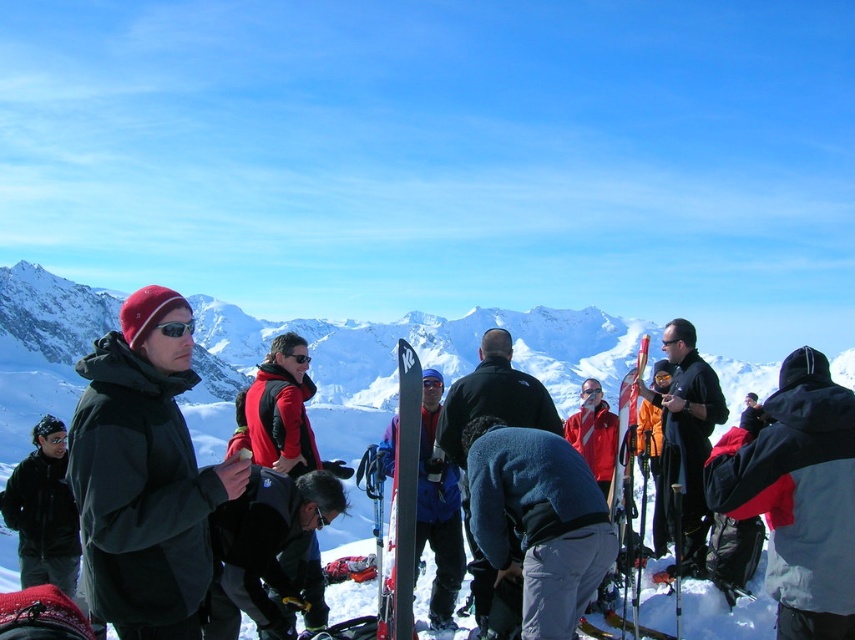
Is point (817, 627) farther from camera compared to point (380, 557)?

No, (817, 627) is closer to viewer.

Which is below, red jacket at center or matte black ski at center?

Positioned lower is matte black ski at center.

Measure the distance between point [841,403] and camera.

Point [841,403] and camera are 65.59 meters apart.

This screenshot has width=855, height=640. Identify the location of red jacket at center. (795, 493).

Can you confirm if white powder snow at center is smaller than black matte goggles at center?

No, white powder snow at center is not smaller than black matte goggles at center.

Based on the photo, can you confirm if white powder snow at center is positioned above black matte goggles at center?

No, white powder snow at center is not above black matte goggles at center.

The image size is (855, 640). Identify the location of white powder snow at center. (394, 364).

Looking at this image, is the position of red jacket at center less distant than that of black matte goggles at center?

Yes.

Does red jacket at center have a smaller size compared to black matte goggles at center?

No.

Where is `red jacket at center`? red jacket at center is located at coordinates (795, 493).